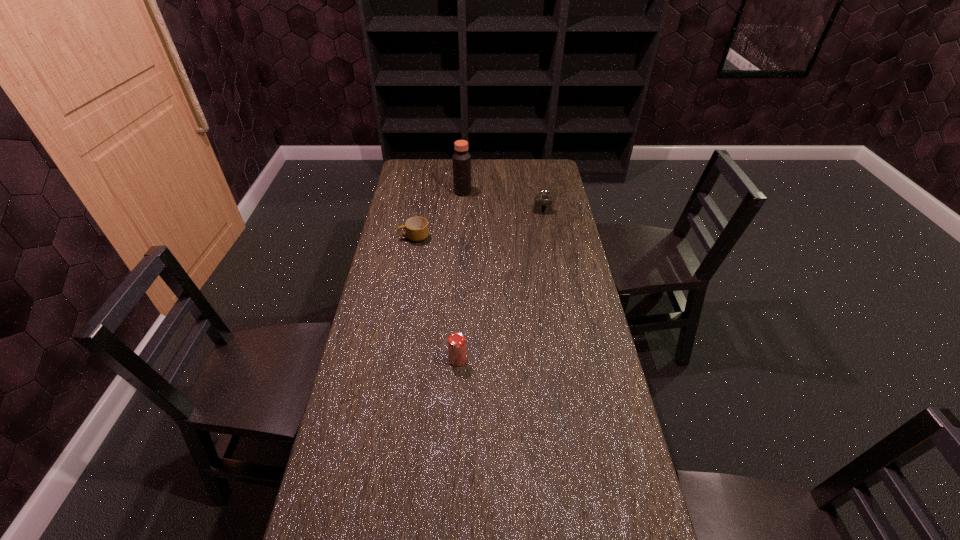
Where is `vacant space in between the beer can and the vinegar`? Image resolution: width=960 pixels, height=540 pixels. vacant space in between the beer can and the vinegar is located at coordinates (460, 275).

Where is `free area in between the rightmost object and the shortest object`? The image size is (960, 540). free area in between the rightmost object and the shortest object is located at coordinates (478, 224).

I want to click on vacant space that is in between the second nearest object and the nearest object, so click(436, 298).

Locate an element on the screen. The height and width of the screenshot is (540, 960). free space that is in between the padlock and the nearest object is located at coordinates (500, 286).

This screenshot has width=960, height=540. Identify the location of object that is the second nearest to the mug. (542, 203).

The width and height of the screenshot is (960, 540). I want to click on object identified as the second closest to the leftmost object, so click(x=542, y=203).